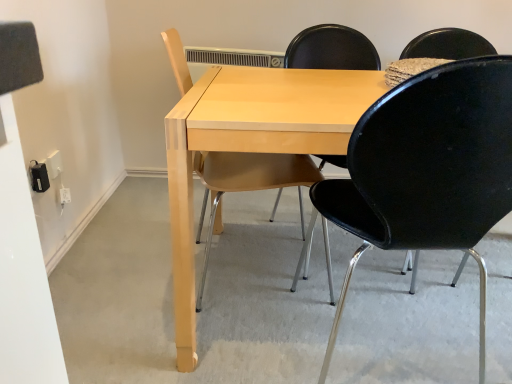
Find the location of a particular element. The height and width of the screenshot is (384, 512). vacant area on the back side of light wood chair at center, the 2th chair positioned from the right is located at coordinates coord(244,233).